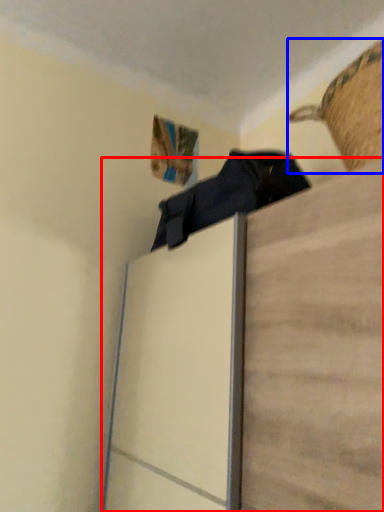
Question: Which of the following is the closest to the observer, furniture (highlighted by a red box) or basket (highlighted by a blue box)?

Choices:
 (A) furniture
 (B) basket

Answer: (A)